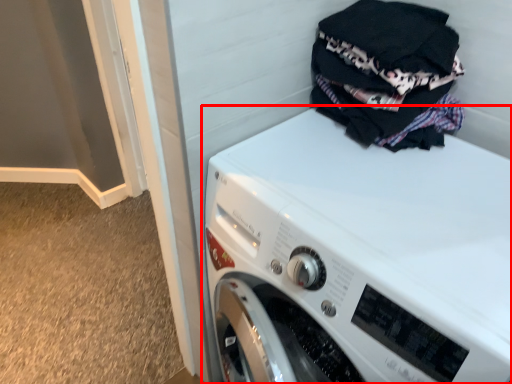
Question: From the image's perspective, where is washing machine (annotated by the red box) located relative to laundry?

Choices:
 (A) below
 (B) above

Answer: (A)